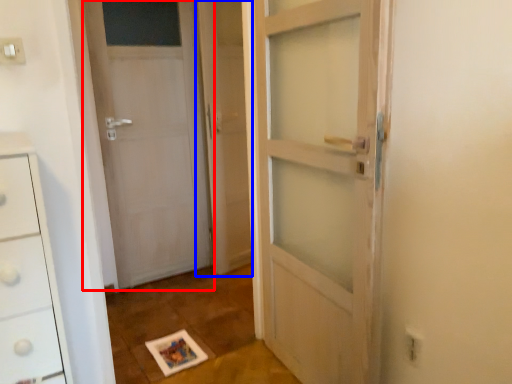
Question: Which object appears closest to the camera in this image, door (highlighted by a red box) or screen door (highlighted by a blue box)?

Choices:
 (A) door
 (B) screen door

Answer: (A)